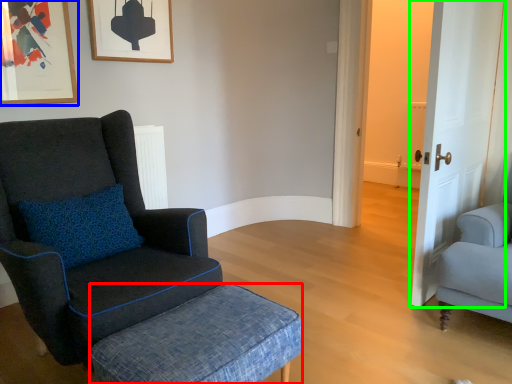
Question: Estimate the real-world distances between objects in this image. Which object is closer to stool (highlighted by a red box), picture frame (highlighted by a blue box) or door (highlighted by a green box)?

Choices:
 (A) picture frame
 (B) door

Answer: (B)